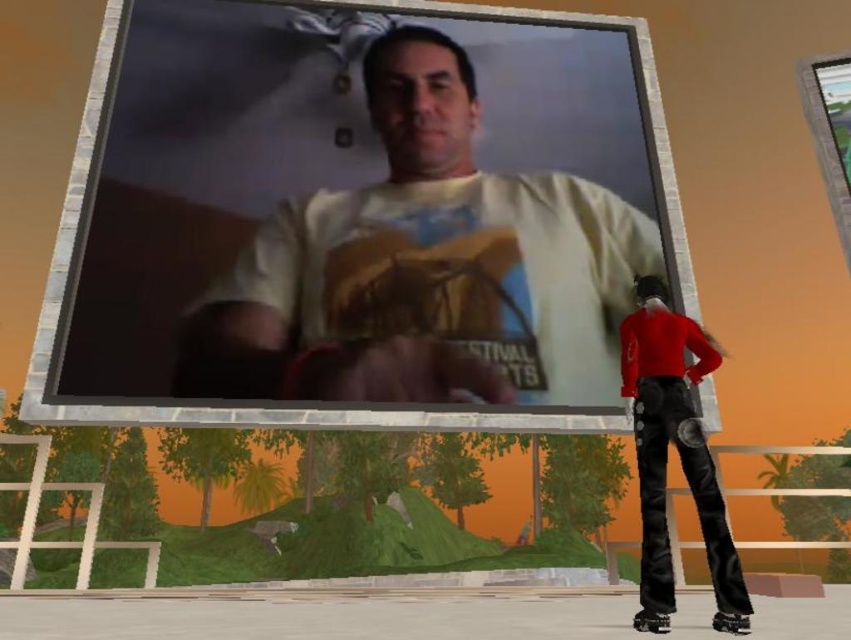
Question: Can you confirm if matte plastic billboard at center is bigger than leather pants at lower right?

Choices:
 (A) no
 (B) yes

Answer: (A)

Question: Is matte plastic billboard at center below leather pants at lower right?

Choices:
 (A) no
 (B) yes

Answer: (A)

Question: Is matte plastic billboard at center to the left of leather pants at lower right from the viewer's perspective?

Choices:
 (A) no
 (B) yes

Answer: (B)

Question: Which point is farther to the camera?

Choices:
 (A) (609, 99)
 (B) (730, 627)

Answer: (A)

Question: Which of the following is the closest to the observer?

Choices:
 (A) matte plastic billboard at center
 (B) leather pants at lower right

Answer: (B)